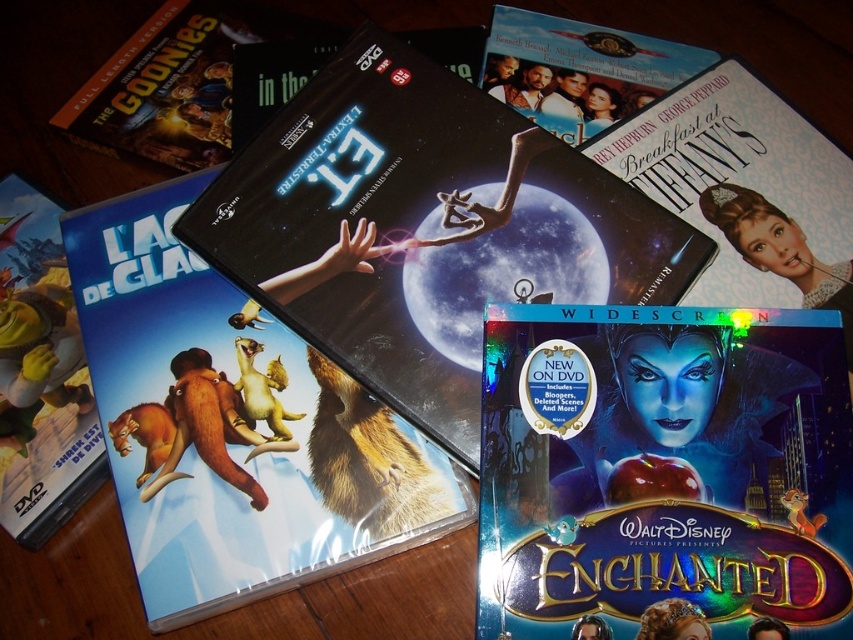
Question: Can you confirm if blue glossy dvd case at center is bigger than shiny silver dvd case at center?

Choices:
 (A) no
 (B) yes

Answer: (A)

Question: Which of the following is the farthest from the observer?

Choices:
 (A) black glossy dvd case at center
 (B) blue glossy dvd case at center
 (C) blue glossy dvd case at lower left

Answer: (C)

Question: Can you confirm if blue glossy dvd case at center is positioned above blue glossy dvd case at lower left?

Choices:
 (A) yes
 (B) no

Answer: (B)

Question: Among these points, which one is nearest to the camera?

Choices:
 (A) (158, 449)
 (B) (35, 189)

Answer: (A)

Question: Which point is farther from the camera taking this photo?

Choices:
 (A) (167, 188)
 (B) (12, 458)

Answer: (A)

Question: Does black glossy dvd case at center have a lesser width compared to blue glossy dvd case at lower left?

Choices:
 (A) yes
 (B) no

Answer: (B)